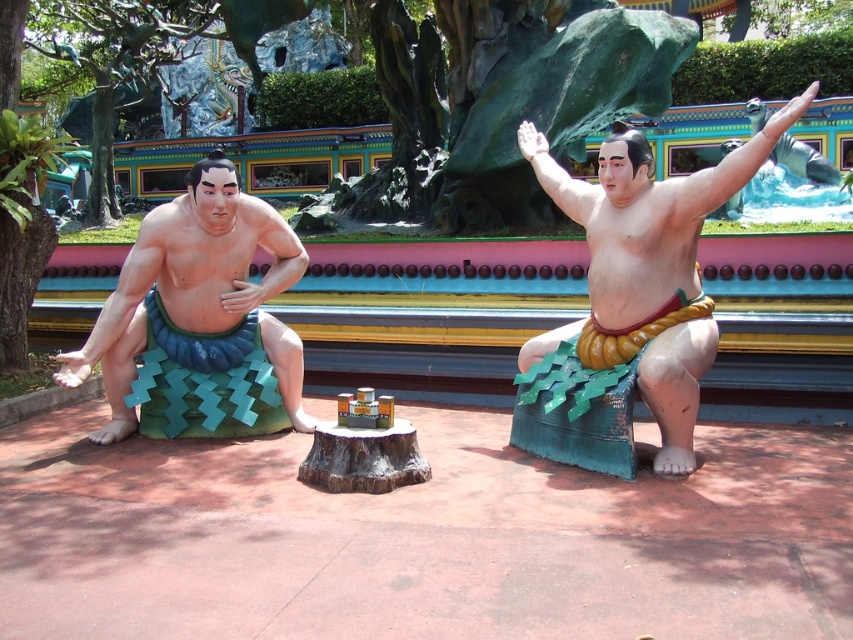
Question: Does matte green fabric at left appear on the left side of matte green fabric at center?

Choices:
 (A) yes
 (B) no

Answer: (A)

Question: Which object appears closest to the camera in this image?

Choices:
 (A) matte green fabric at left
 (B) matte green fabric at center

Answer: (B)

Question: Can you confirm if matte green fabric at left is thinner than matte green fabric at center?

Choices:
 (A) no
 (B) yes

Answer: (A)

Question: Which object appears closest to the camera in this image?

Choices:
 (A) matte green fabric at left
 (B) matte green fabric at center

Answer: (B)

Question: Can you confirm if matte green fabric at left is positioned below matte green fabric at center?

Choices:
 (A) yes
 (B) no

Answer: (A)

Question: Which object is closer to the camera taking this photo?

Choices:
 (A) matte green fabric at left
 (B) matte green fabric at center

Answer: (B)